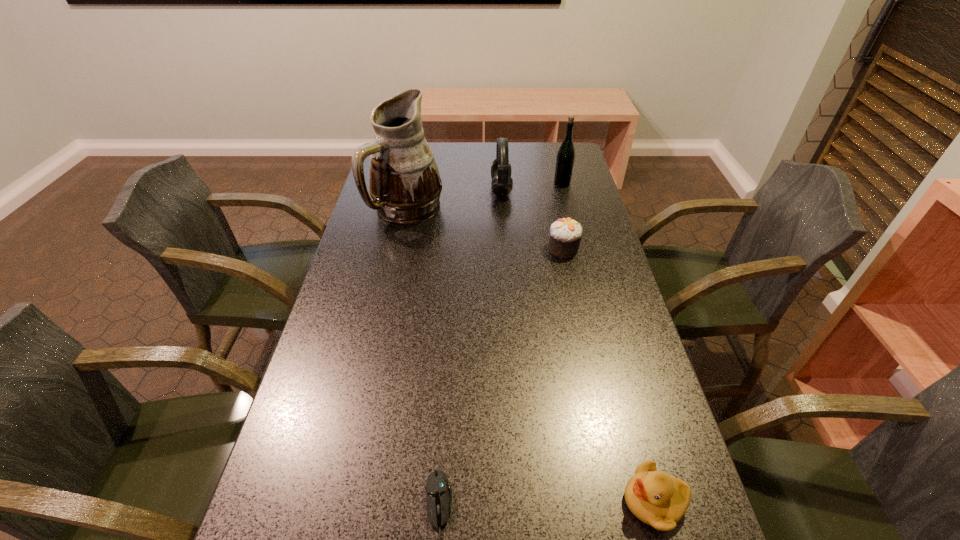
Locate an element on the screen. This screenshot has height=540, width=960. vacant area in the image that satisfies the following two spatial constraints: 1. on the earcups of the fourth shortest object; 2. on the left side of the third nearest object is located at coordinates (505, 248).

Where is `free location that satisfies the following two spatial constraints: 1. from the spout of the cupcake; 2. on the right side of the pitcher`? free location that satisfies the following two spatial constraints: 1. from the spout of the cupcake; 2. on the right side of the pitcher is located at coordinates (399, 248).

Locate an element on the screen. This screenshot has width=960, height=540. vacant region that satisfies the following two spatial constraints: 1. on the front side of the fifth shortest object; 2. on the earcups of the third tallest object is located at coordinates (564, 190).

Locate an element on the screen. free spot that satisfies the following two spatial constraints: 1. on the back side of the fourth farthest object; 2. on the earcups of the headset is located at coordinates (551, 190).